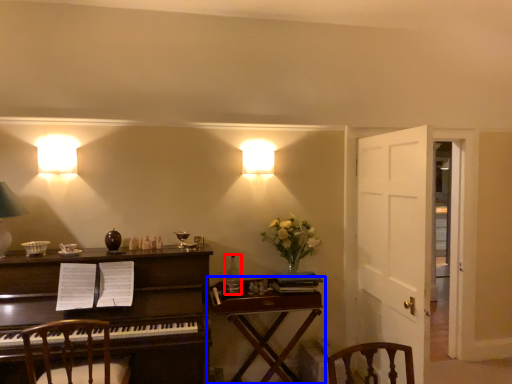
Question: Which object is further to the camera taking this photo, bottle (highlighted by a red box) or table (highlighted by a blue box)?

Choices:
 (A) bottle
 (B) table

Answer: (A)